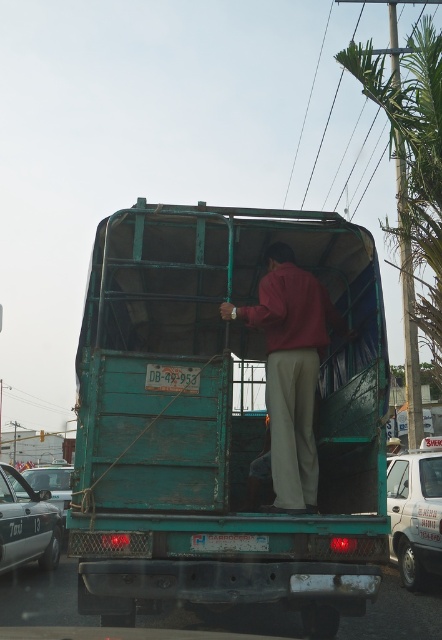
You are a pedestrian standing on the sidewalk. You see a teal matte truck at center and a white glossy van at lower right. Which vehicle is closer to you?

The teal matte truck at center is closer to you because it is in front of the white glossy van at lower right.

You are a delivery driver who needs to check the license plate of the green truck. While looking at the truck, you also notice a metallic silver car nearby. Which object is taller between the green matte license plate at center and the metallic silver car at lower left?

The metallic silver car at lower left is taller than the green matte license plate at center because the license plate is shorter than the car.